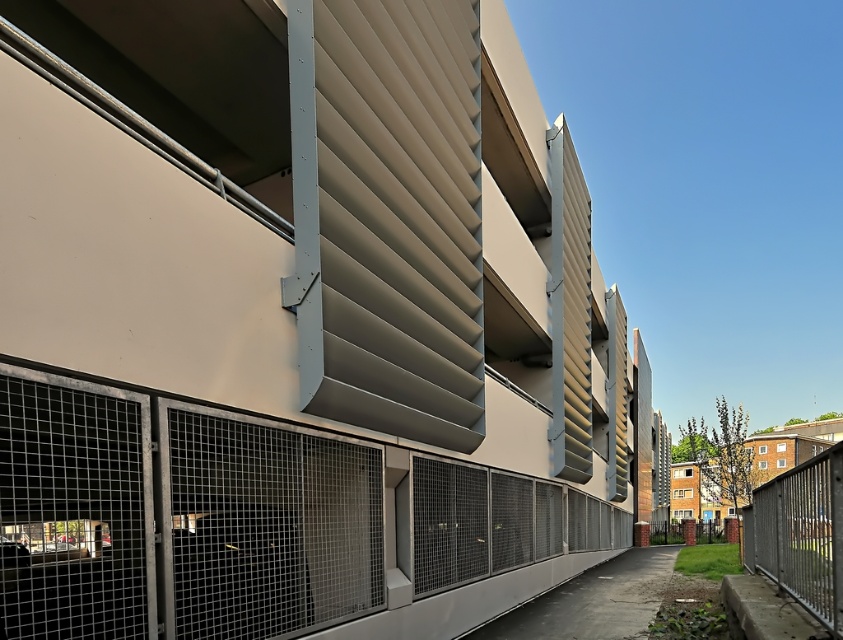
Question: Which point is closer to the camera?

Choices:
 (A) metal mesh fence at center
 (B) metallic silver fence at lower right

Answer: (A)

Question: Can you confirm if metal mesh fence at center is thinner than metallic silver fence at lower right?

Choices:
 (A) yes
 (B) no

Answer: (B)

Question: Can you confirm if metal mesh fence at center is positioned to the left of metallic silver fence at lower right?

Choices:
 (A) no
 (B) yes

Answer: (B)

Question: Does metal mesh fence at center have a lesser width compared to metallic silver fence at lower right?

Choices:
 (A) no
 (B) yes

Answer: (A)

Question: Which object appears closest to the camera in this image?

Choices:
 (A) metallic silver fence at lower right
 (B) metal mesh fence at center

Answer: (B)